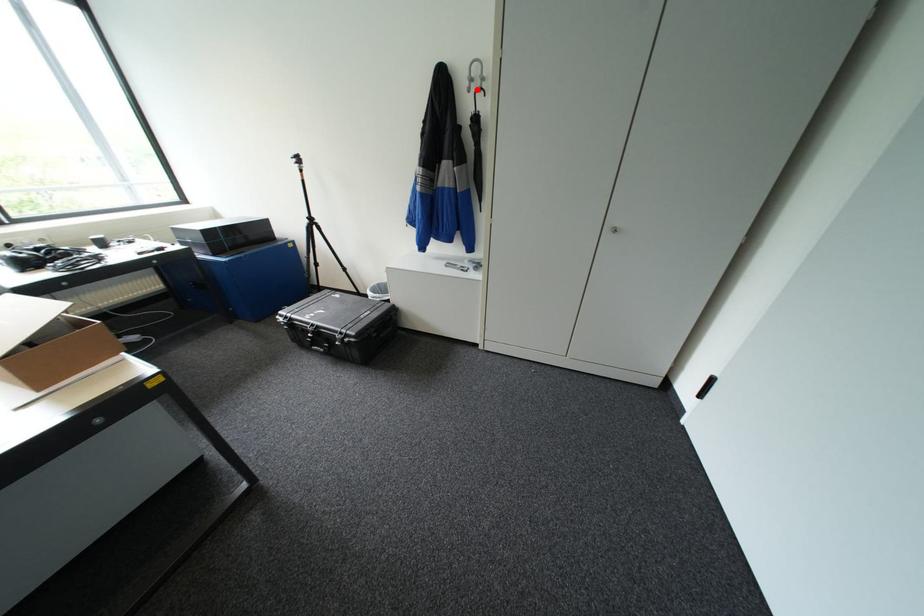
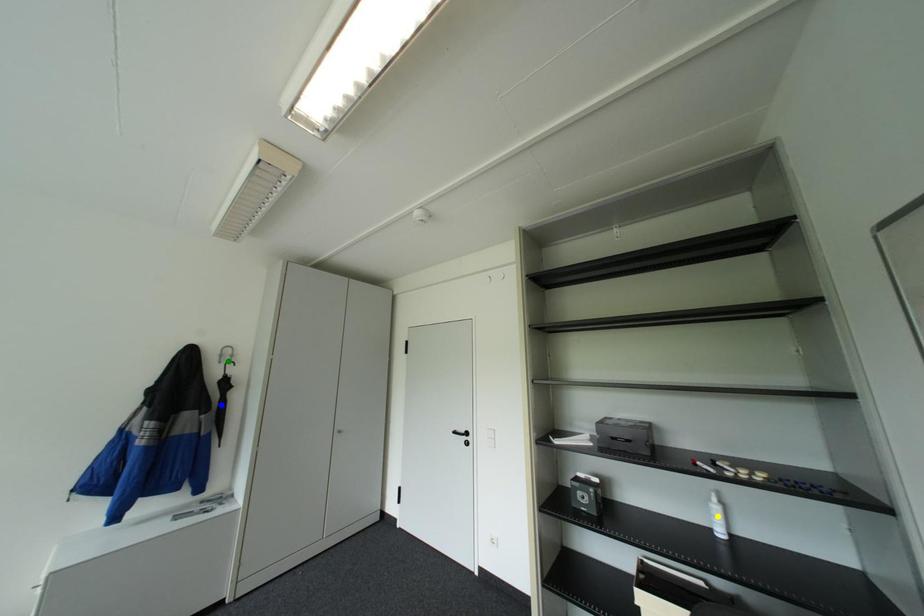
Question: I am providing you with two images of the same scene from different viewpoints. A red point is marked on the first image. You are given multiple points on the second image. Which point in image 2 is actually the same real-world point as the red point in image 1?

Choices:
 (A) yellow point
 (B) blue point
 (C) green point

Answer: (C)